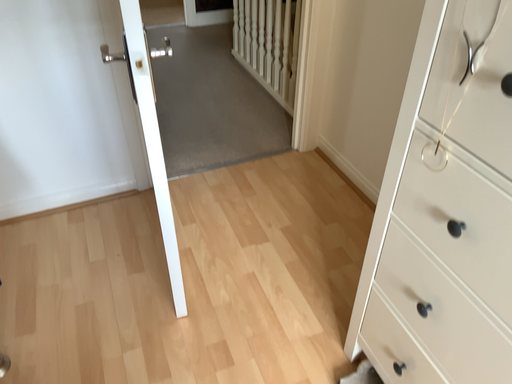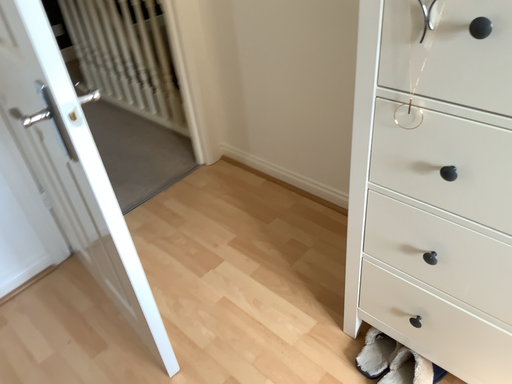
Question: How did the camera likely rotate when shooting the video?

Choices:
 (A) rotated left
 (B) rotated right

Answer: (B)